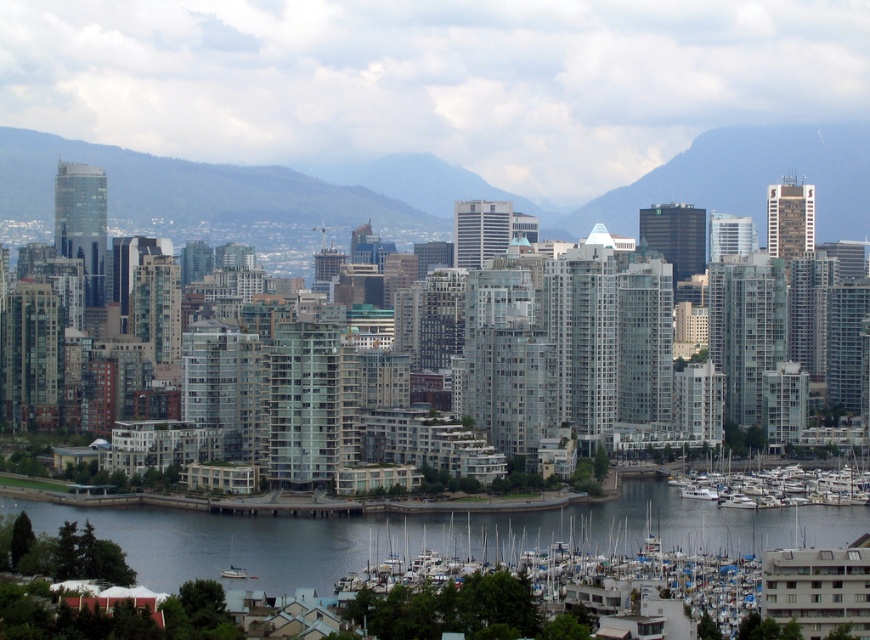
You are a photographer planning to capture the reflection of the white matte boats at lower right in the transparent water at lower center. Based on the scene, is the position of the boats suitable for this reflection?

The transparent water at lower center is above white matte boats at lower right, so the boats are positioned below the water. Since reflections typically appear on the surface of water, the boats being below the water might not allow their reflections to be captured as they are submerged.

You are a drone operator trying to navigate between two points in the cityscape image. You need to fly from point A to point B. If point A is point (x=740, y=513) and point B is point (x=616, y=211), which point is closer to you as you fly towards them?

Point (x=740, y=513) is closer to you than point (x=616, y=211) because it is further to the viewer, meaning it would be encountered first along your flight path.

You are standing at the center of the image and want to locate the white matte boats at lower right. According to the coordinates provided, in which direction should you look to find them?

The white matte boats at lower right are located at coordinates point (452, 608), which means you should look to the lower right direction to find them.